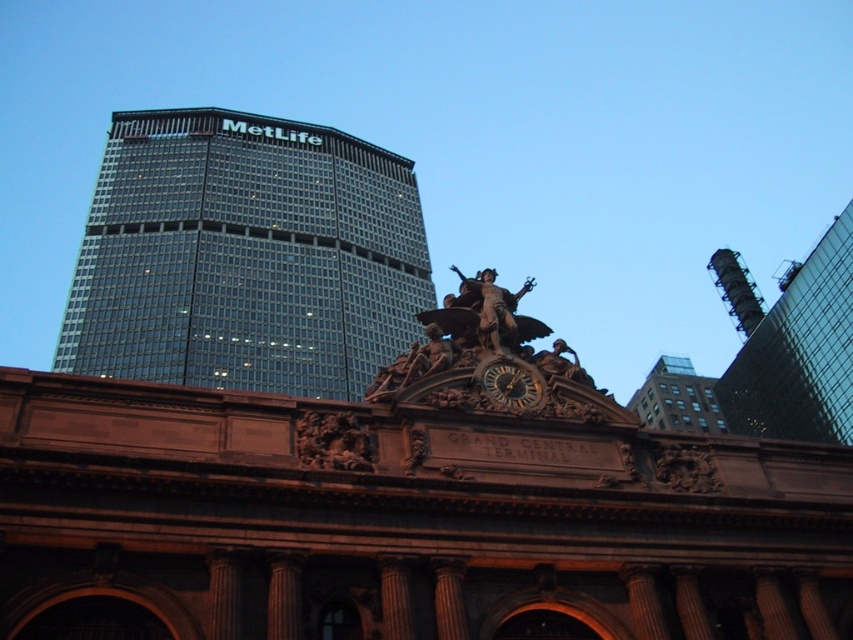
Is glassy steel skyscraper at upper left shorter than wooden carved clock at center?

No, glassy steel skyscraper at upper left is not shorter than wooden carved clock at center.

Is glassy steel skyscraper at upper left to the left of wooden carved clock at center from the viewer's perspective?

Indeed, glassy steel skyscraper at upper left is positioned on the left side of wooden carved clock at center.

Is point (296, 230) more distant than point (531, 403)?

Yes, point (296, 230) is farther from viewer.

Where is `glassy steel skyscraper at upper left`? glassy steel skyscraper at upper left is located at coordinates (245, 257).

Between glassy steel bell tower at upper right and bronze statue at center, which one appears on the right side from the viewer's perspective?

Positioned to the right is glassy steel bell tower at upper right.

Who is taller, glassy steel bell tower at upper right or bronze statue at center?

Standing taller between the two is glassy steel bell tower at upper right.

Describe the element at coordinates (799, 352) in the screenshot. The width and height of the screenshot is (853, 640). I see `glassy steel bell tower at upper right` at that location.

Find the location of a particular element. The height and width of the screenshot is (640, 853). glassy steel bell tower at upper right is located at coordinates (799, 352).

Who is more distant from viewer, [786,358] or [693,387]?

The point [693,387] is more distant.

Between glassy steel bell tower at upper right and brown brick building at upper right, which one has less height?

Standing shorter between the two is brown brick building at upper right.

Between point (782, 324) and point (657, 394), which one is positioned behind?

Positioned behind is point (657, 394).

At what (x,y) coordinates should I click in order to perform the action: click on glassy steel bell tower at upper right. Please return your answer as a coordinate pair (x, y). This screenshot has height=640, width=853. Looking at the image, I should click on (799, 352).